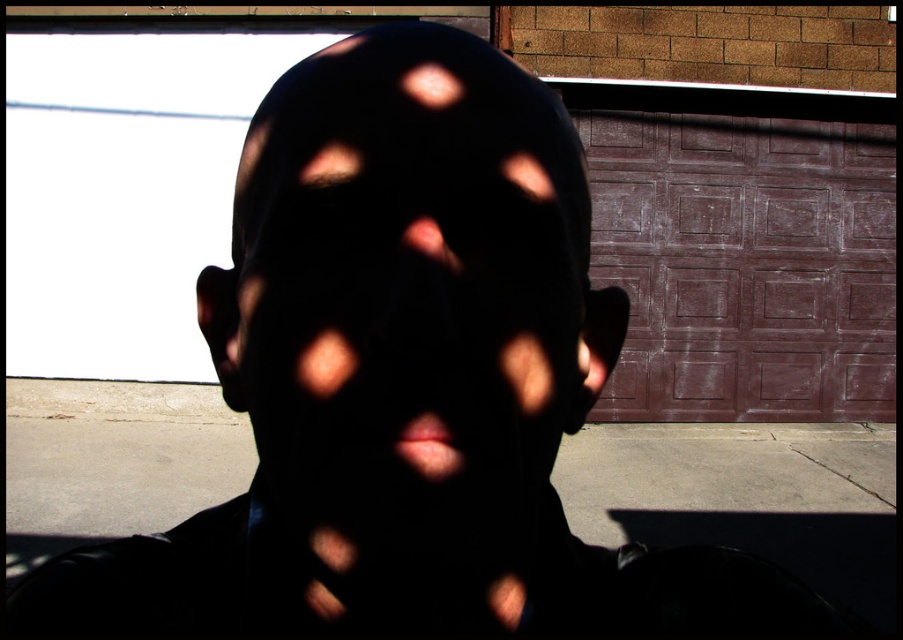
Question: Among these points, which one is nearest to the camera?

Choices:
 (A) (608, 324)
 (B) (645, 406)

Answer: (A)

Question: Which point appears farthest from the camera in this image?

Choices:
 (A) (733, 292)
 (B) (293, 275)

Answer: (A)

Question: Can you confirm if black matte face at center is bigger than brown textured garage door at center?

Choices:
 (A) yes
 (B) no

Answer: (B)

Question: Does black matte face at center lie behind brown textured garage door at center?

Choices:
 (A) no
 (B) yes

Answer: (A)

Question: Is black matte face at center thinner than brown textured garage door at center?

Choices:
 (A) yes
 (B) no

Answer: (A)